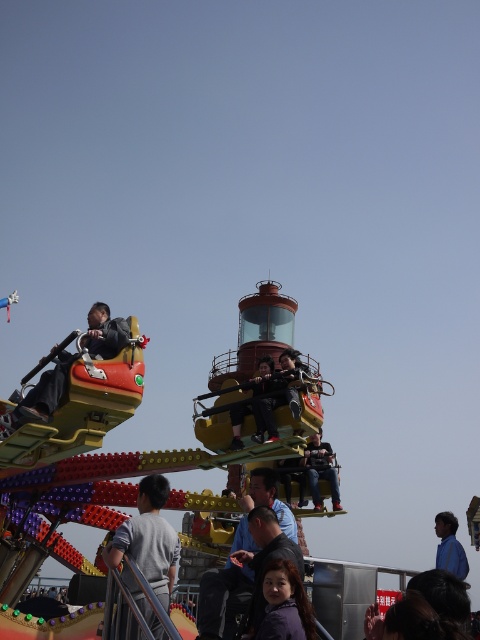
You are a photographer trying to capture a candid shot of the riders on the lighthouse ride. You notice two people in the scene wearing the matte black pants at center and the blue shirt at lower right. Which clothing item is smaller in size between the two?

The matte black pants at center has a smaller size compared to the blue shirt at lower right, so the matte black pants at center is the smaller clothing item between the two.

You are a photographer standing at the entrance of the amusement park. You see a person wearing a dark blue fabric jacket at center and denim jeans at center. Based on their clothing, can you determine if the jacket is positioned higher or lower than the jeans?

The dark blue fabric jacket at center is below denim jeans at center, so the jacket is positioned lower than the jeans.